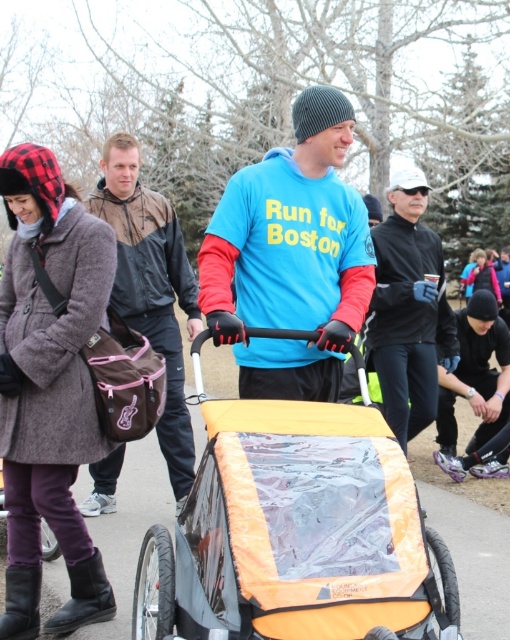
You are standing at the point labeled as point [151,289] in the image. What object is directly under your feet?

The point [151,289] is on brown fabric jacket at center, so the object directly under your feet is the brown fabric jacket at center.